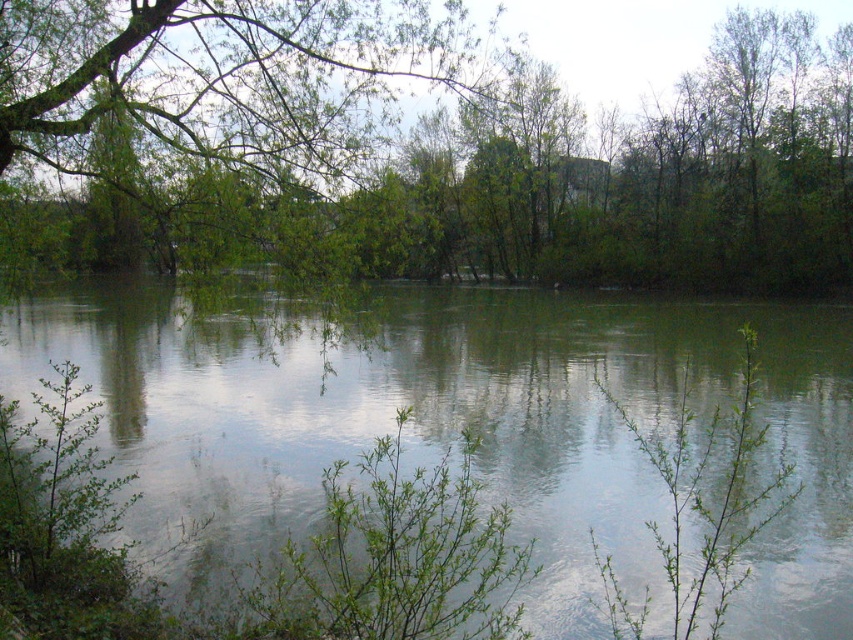
Based on the photo, you are standing in a natural setting and want to walk towards the green reflective water at center. There is a green leafy tree at center blocking your path. Can you walk around it to reach the water?

The green leafy tree at center is closer to you than the green reflective water at center, so you can walk around the green leafy tree at center to reach the green reflective water at center.

Based on the photo, you are standing at the edge of the water in the scene. There is a green leafy tree at center marked by point (415,148). Which direction should you walk to reach the green leafy tree at center?

The green leafy tree at center is located at point (415,148), so you should walk towards the center of the scene to reach it.